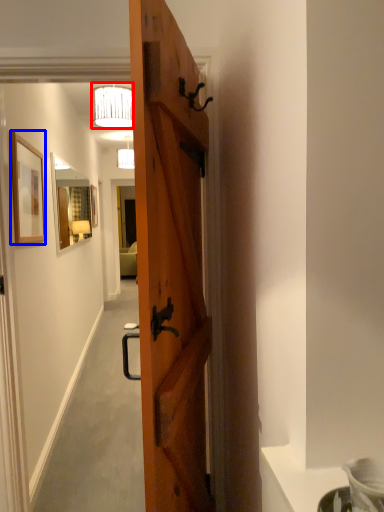
Question: Which object is further to the camera taking this photo, lamp (highlighted by a red box) or picture frame (highlighted by a blue box)?

Choices:
 (A) lamp
 (B) picture frame

Answer: (A)